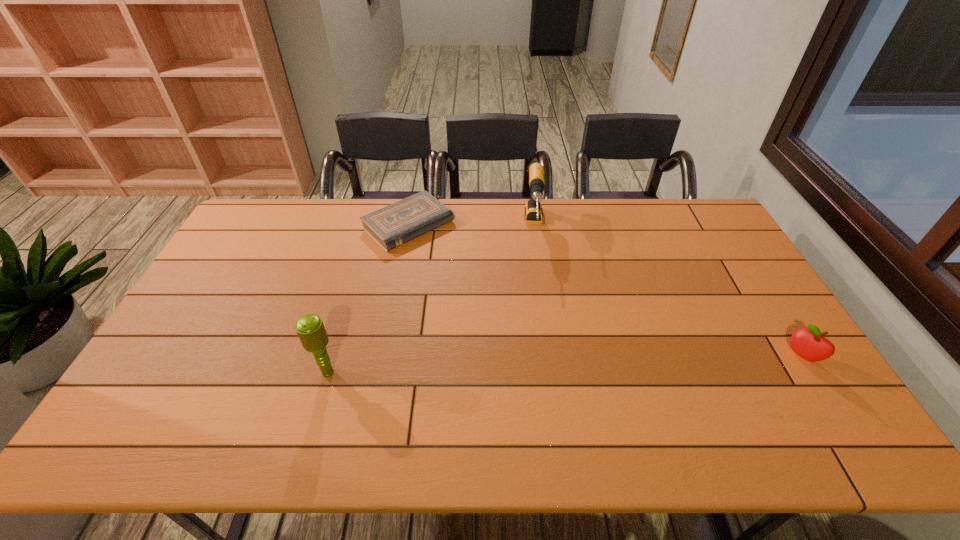
Find the location of a particular element. microphone is located at coordinates (310, 328).

The image size is (960, 540). In order to click on apple in this screenshot , I will do `click(810, 344)`.

The width and height of the screenshot is (960, 540). I want to click on the rightmost object, so click(x=810, y=344).

Identify the location of drill. This screenshot has width=960, height=540. (533, 210).

Identify the location of Bible. (393, 225).

This screenshot has width=960, height=540. I want to click on vacant space situated on the back of the microphone, so click(x=348, y=302).

In order to click on vacant space situated on the left of the apple in this screenshot , I will do `click(733, 356)`.

Find the location of `free space located 0.360m on the handle side of the second object from right to left`. free space located 0.360m on the handle side of the second object from right to left is located at coordinates (540, 341).

The height and width of the screenshot is (540, 960). Find the location of `vacant space positioned on the handle side of the second object from right to left`. vacant space positioned on the handle side of the second object from right to left is located at coordinates (540, 353).

Locate an element on the screen. The height and width of the screenshot is (540, 960). free location located on the handle side of the second object from right to left is located at coordinates (539, 295).